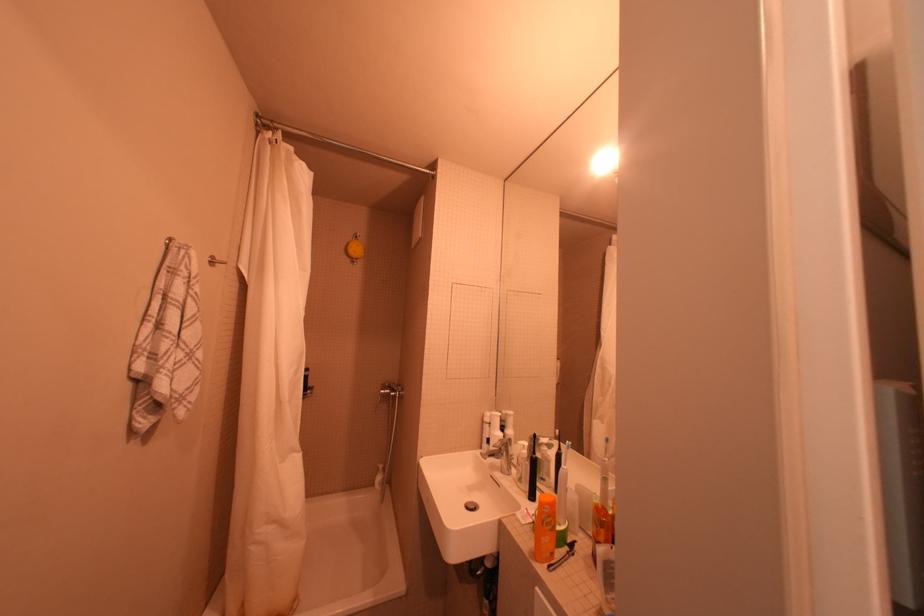
Image resolution: width=924 pixels, height=616 pixels. I want to click on handheld shower head, so click(391, 392).